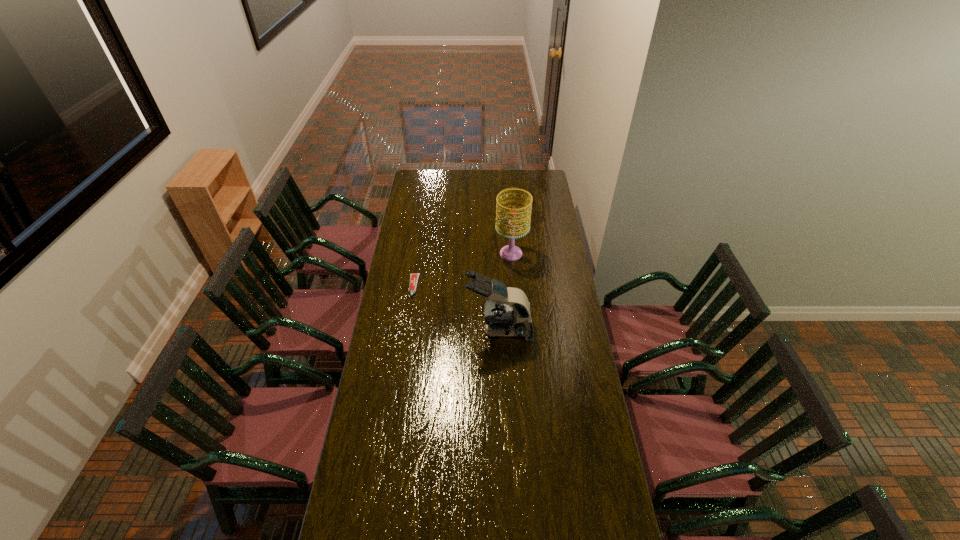
This screenshot has width=960, height=540. Identify the location of free spot at the left edge of the desktop. (396, 399).

The height and width of the screenshot is (540, 960). I want to click on free location at the right edge, so click(600, 518).

At what (x,y) coordinates should I click in order to perform the action: click on vacant area between the microscope and the leftmost object. Please return your answer as a coordinate pair (x, y). Looking at the image, I should click on (457, 308).

Locate an element on the screen. The width and height of the screenshot is (960, 540). free point between the microscope and the second nearest object is located at coordinates (457, 308).

Locate an element on the screen. This screenshot has height=540, width=960. free area in between the lampshade and the leftmost object is located at coordinates [x=463, y=270].

What are the coordinates of `vacant region between the leftmost object and the lampshade` in the screenshot? It's located at (463, 270).

At what (x,y) coordinates should I click in order to perform the action: click on vacant area that lies between the farthest object and the shortest object. Please return your answer as a coordinate pair (x, y). This screenshot has width=960, height=540. Looking at the image, I should click on (463, 270).

Find the location of `free spot between the nearest object and the second nearest object`. free spot between the nearest object and the second nearest object is located at coordinates (457, 308).

I want to click on object that stands as the second closest to the microscope, so click(510, 252).

At what (x,y) coordinates should I click in order to perform the action: click on the second closest object relative to the lampshade. Please return your answer as a coordinate pair (x, y). Looking at the image, I should click on (413, 282).